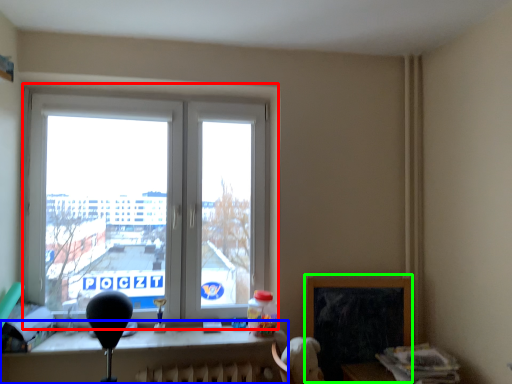
Question: Based on their relative distances, which object is nearer to window (highlighted by a red box)? Choose from table (highlighted by a blue box) and window screen (highlighted by a green box).

Choices:
 (A) table
 (B) window screen

Answer: (A)